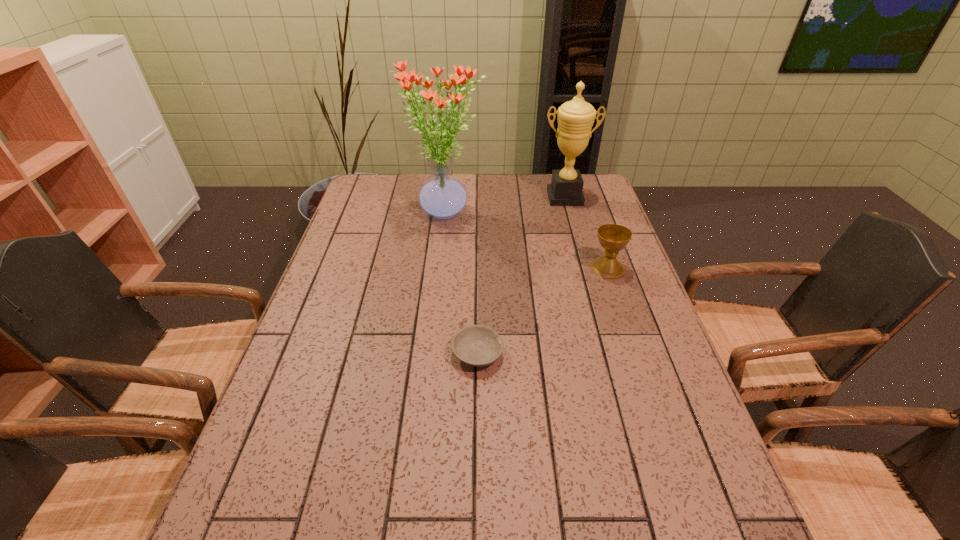
Identify the location of flower arrangement. (443, 197).

Where is `the second tallest object`? This screenshot has width=960, height=540. the second tallest object is located at coordinates (576, 117).

Where is `the third farthest object`? Image resolution: width=960 pixels, height=540 pixels. the third farthest object is located at coordinates (613, 237).

Identify the location of the second shortest object. The height and width of the screenshot is (540, 960). (613, 237).

Locate an element on the screen. The width and height of the screenshot is (960, 540). the nearest object is located at coordinates (477, 345).

Identify the location of bowl. (477, 345).

Where is `free location located on the back of the flower arrangement`? This screenshot has width=960, height=540. free location located on the back of the flower arrangement is located at coordinates (448, 177).

This screenshot has width=960, height=540. I want to click on vacant area situated at the front of the third shortest object with handles, so click(x=580, y=252).

Where is `vacant area situated on the left of the second nearest object`? This screenshot has height=540, width=960. vacant area situated on the left of the second nearest object is located at coordinates (458, 268).

This screenshot has height=540, width=960. Identify the location of vacant space located on the front of the nearest object. (477, 469).